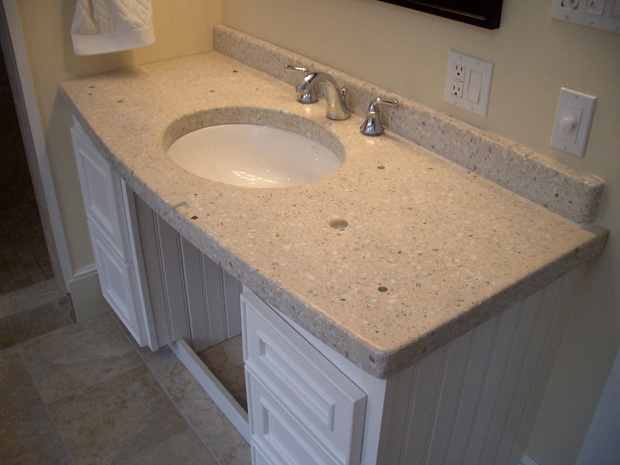
At what (x,y) coordinates should I click in order to perform the action: click on hand towel. Please return your answer as a coordinate pair (x, y). The width and height of the screenshot is (620, 465). Looking at the image, I should click on (110, 24).